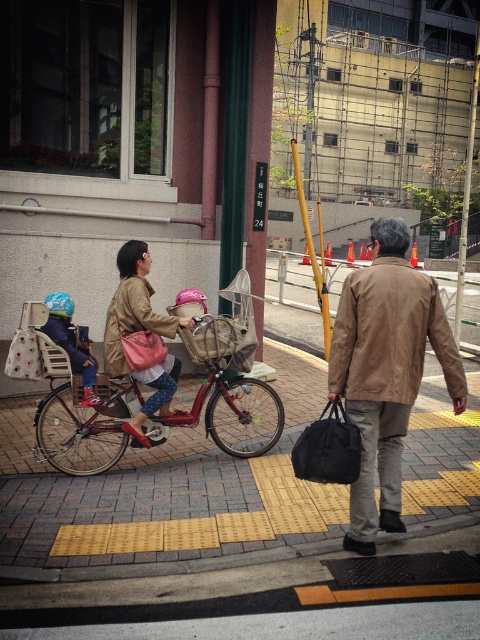
Question: Does brown leather jacket at center have a smaller size compared to matte brown jacket at center?

Choices:
 (A) yes
 (B) no

Answer: (B)

Question: Which point is farther from the camera taking this photo?

Choices:
 (A) (265, 397)
 (B) (389, 456)
 (C) (192, 326)
 (D) (91, 396)

Answer: (A)

Question: Does brown leather jacket at center have a larger size compared to metallic red bicycle at center?

Choices:
 (A) no
 (B) yes

Answer: (A)

Question: Which object is positioned closest to the matte blue helmet at left?

Choices:
 (A) matte brown jacket at center
 (B) metallic red bicycle at center
 (C) brown leather jacket at center

Answer: (A)

Question: Is metallic red bicycle at center above matte blue helmet at left?

Choices:
 (A) no
 (B) yes

Answer: (A)

Question: Which object is positioned farthest from the brown leather jacket at center?

Choices:
 (A) metallic red bicycle at center
 (B) matte brown jacket at center

Answer: (A)